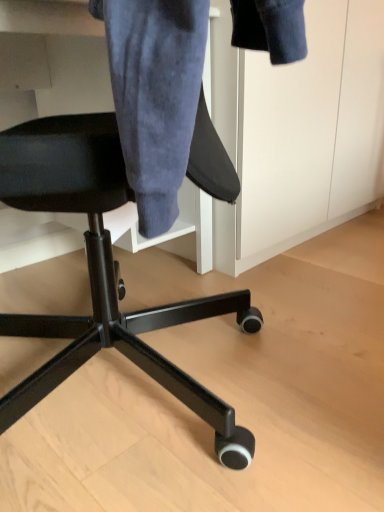
At what (x,y) coordinates should I click in order to perform the action: click on free location in front of denim jacket at upper center. Please return your answer as a coordinate pair (x, y). The width and height of the screenshot is (384, 512). Looking at the image, I should click on (293, 300).